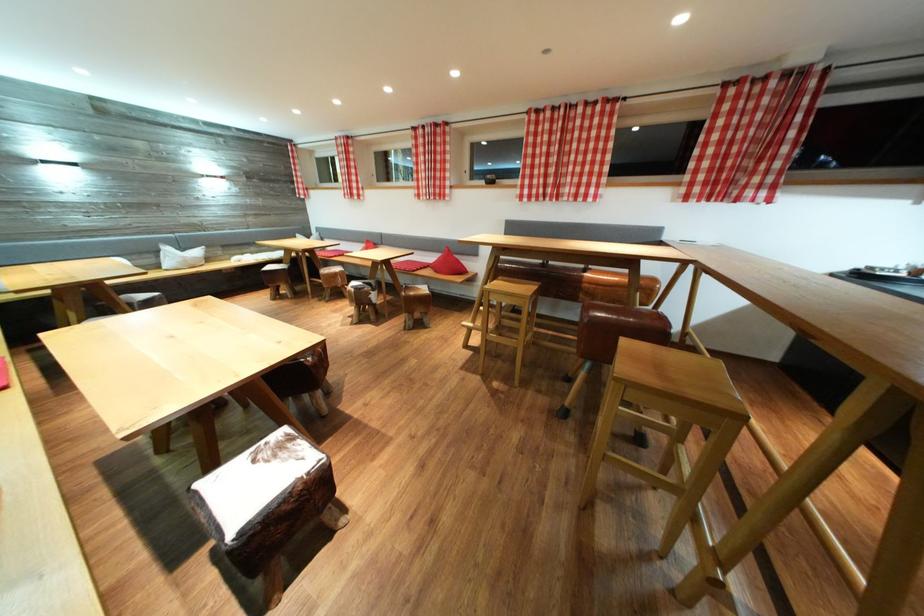
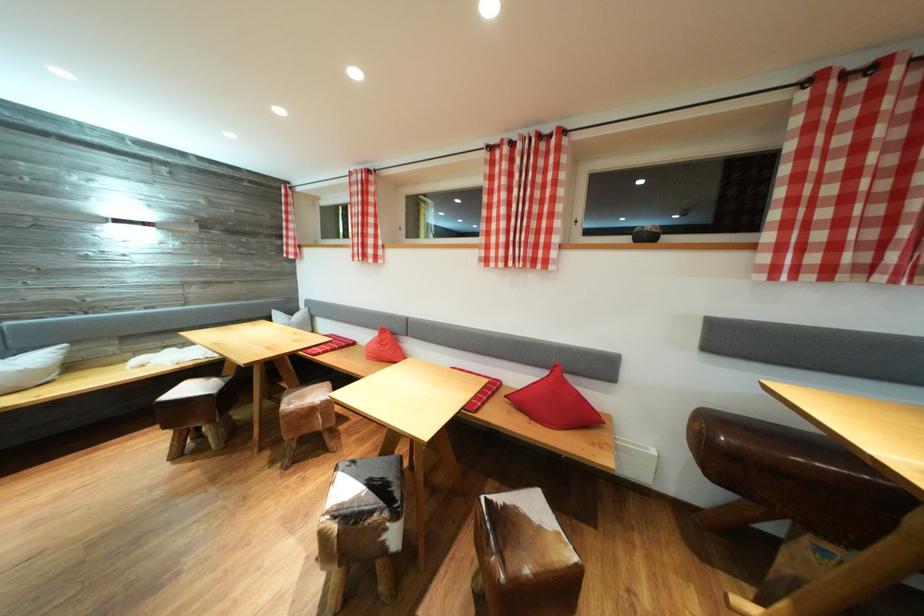
Find the pixel in the second image that matches [544,116] in the first image.

(852, 81)